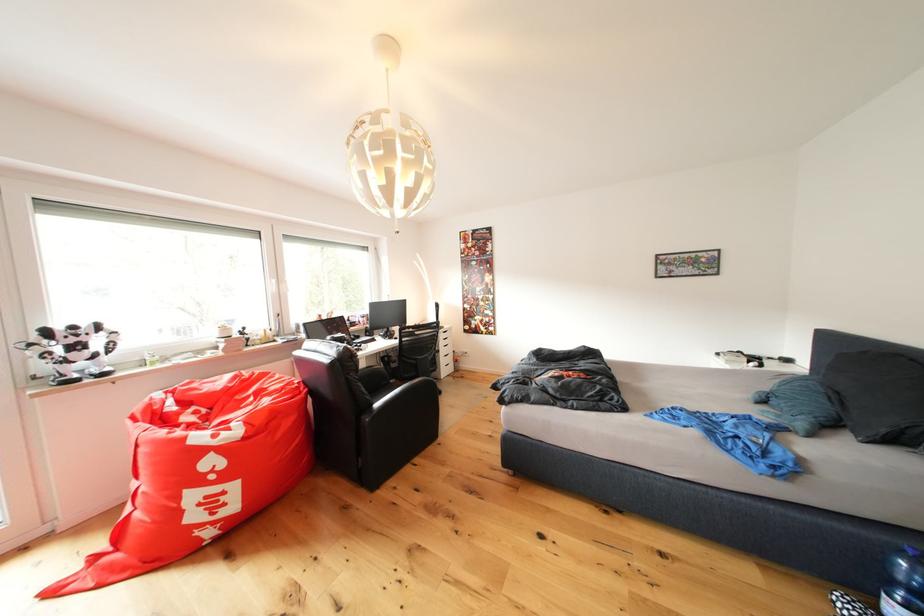
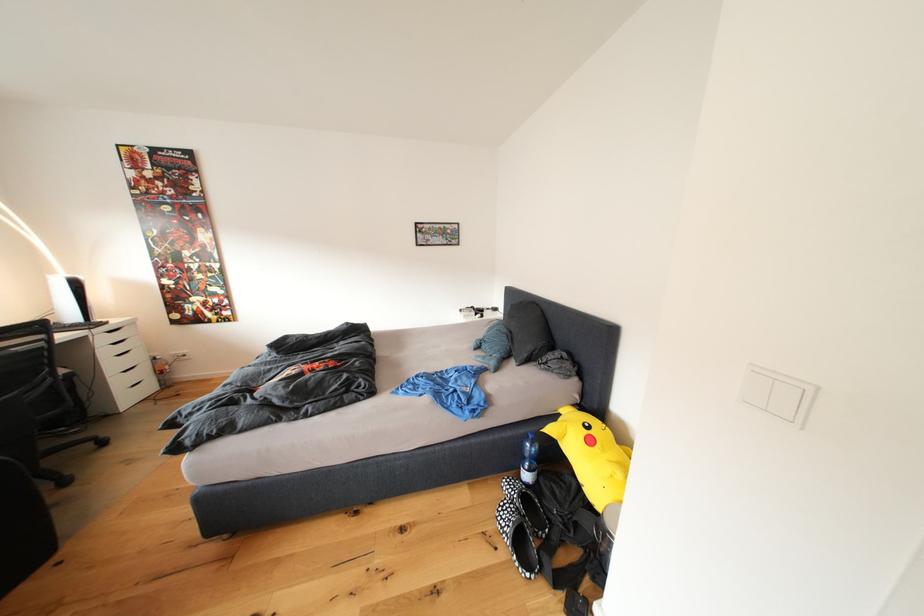
In the second image, find the point that corresponds to (895,565) in the first image.

(531, 451)